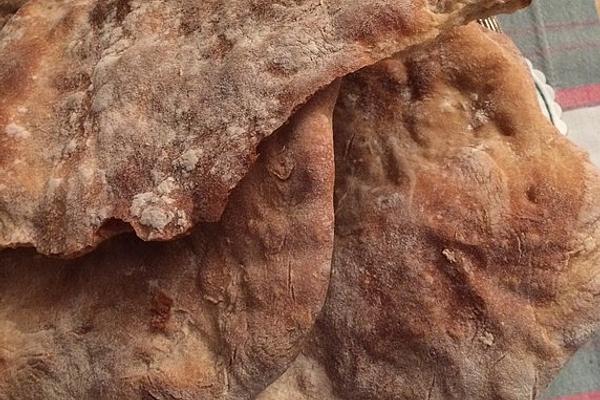
This screenshot has height=400, width=600. I want to click on silver utensil, so click(x=490, y=24).